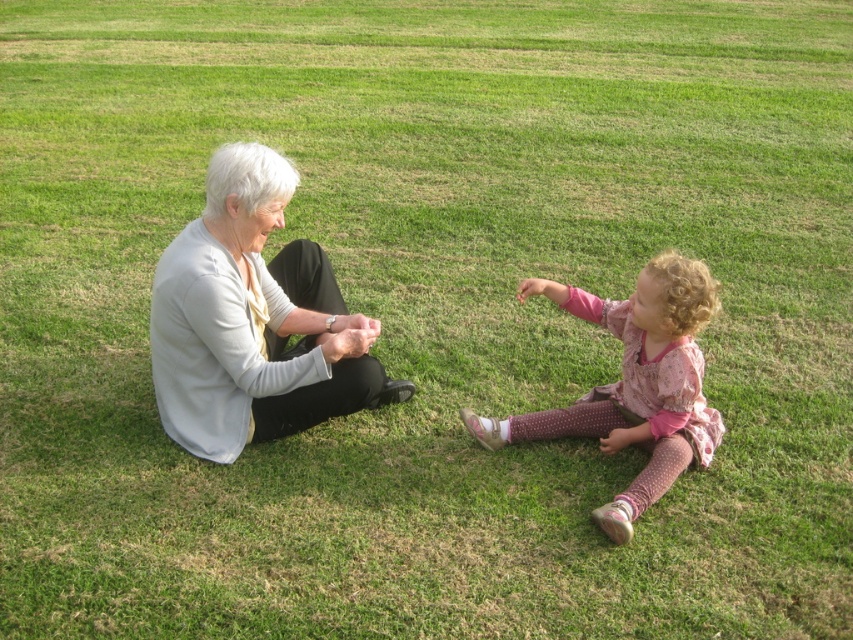
You are a photographer trying to capture a closeup of the white matte sweater at left. What coordinates should you focus on to ensure the sweater is centered in your shot?

You should focus on the coordinates point (253, 321) to center the white matte sweater at left in your shot.